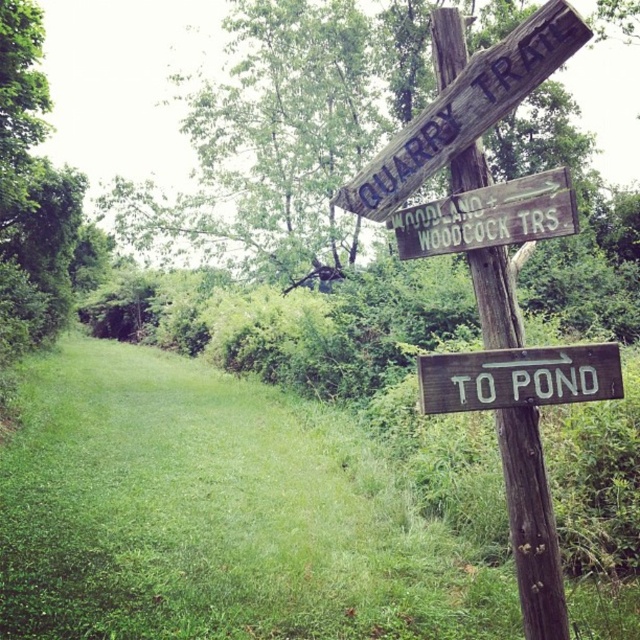
Is point (534, 573) positioned behind point (566, 388)?

Yes, point (534, 573) is behind point (566, 388).

Which of these two, wooden signpost at right or wooden sign at lower right, stands taller?

With more height is wooden signpost at right.

Between point (516, 420) and point (547, 360), which one is positioned in front?

Point (547, 360) is more forward.

You are a GUI agent. You are given a task and a screenshot of the screen. Output one action in this format:
    pyautogui.click(x=<x>, y=<y>)
    Task: Click on the wooden signpost at right
    This screenshot has height=640, width=640.
    Given the screenshot: What is the action you would take?
    pyautogui.click(x=531, y=524)

Between point (483, 104) and point (493, 205), which one is positioned in front?

Point (483, 104) is more forward.

Can you confirm if weathered wood sign at upper center is positioned to the right of wooden signpost at upper center?

In fact, weathered wood sign at upper center is to the left of wooden signpost at upper center.

What do you see at coordinates (465, 109) in the screenshot? This screenshot has height=640, width=640. I see `weathered wood sign at upper center` at bounding box center [465, 109].

Find the location of `weathered wood sign at upper center`. weathered wood sign at upper center is located at coordinates (465, 109).

Does wooden signpost at right have a larger size compared to weathered wood sign at upper center?

Actually, wooden signpost at right might be smaller than weathered wood sign at upper center.

Does wooden signpost at right have a smaller size compared to weathered wood sign at upper center?

Yes.

Does point (524, 593) lie behind point (394, 164)?

That is False.

At what (x,y) coordinates should I click in order to perform the action: click on wooden signpost at right. Please return your answer as a coordinate pair (x, y). Image resolution: width=640 pixels, height=640 pixels. Looking at the image, I should click on (531, 524).